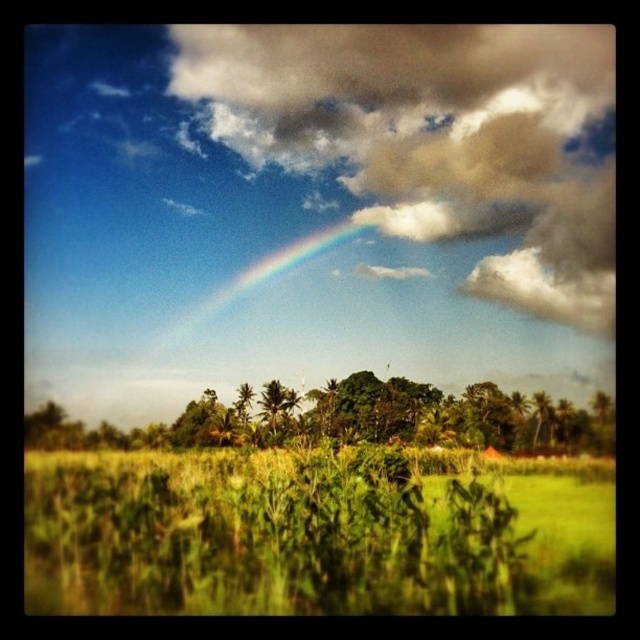
Where is `green leafy trees at center`? The height and width of the screenshot is (640, 640). green leafy trees at center is located at coordinates (355, 419).

Who is shorter, green leafy trees at center or green leafy palm at center?

Standing shorter between the two is green leafy palm at center.

Is point (364, 376) positioned after point (289, 408)?

No, it is not.

At what (x,y) coordinates should I click in order to perform the action: click on green leafy trees at center. Please return your answer as a coordinate pair (x, y). The height and width of the screenshot is (640, 640). Looking at the image, I should click on point(355,419).

Is point (477, 417) behind point (180, 326)?

No, it is in front of (180, 326).

The width and height of the screenshot is (640, 640). Describe the element at coordinates (355, 419) in the screenshot. I see `green leafy trees at center` at that location.

Is point (497, 416) positioned after point (224, 301)?

No, it is in front of (224, 301).

This screenshot has width=640, height=640. Identify the location of green leafy trees at center. (355, 419).

Is cloudy sky at upper center positioned before green leafy palm at center?

No, it is not.

Does cloudy sky at upper center have a greater height compared to green leafy palm at center?

Correct, cloudy sky at upper center is much taller as green leafy palm at center.

Does point (406, 129) lie behind point (268, 413)?

Yes, point (406, 129) is behind point (268, 413).

Locate an element on the screen. Image resolution: width=640 pixels, height=640 pixels. cloudy sky at upper center is located at coordinates (435, 138).